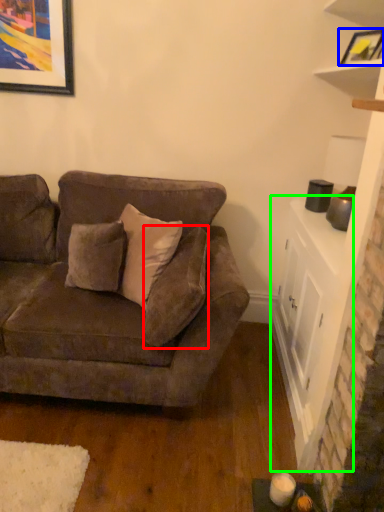
Question: Which object is positioned closest to pillow (highlighted by a red box)? Select from picture frame (highlighted by a blue box) and table (highlighted by a green box).

Choices:
 (A) picture frame
 (B) table

Answer: (B)